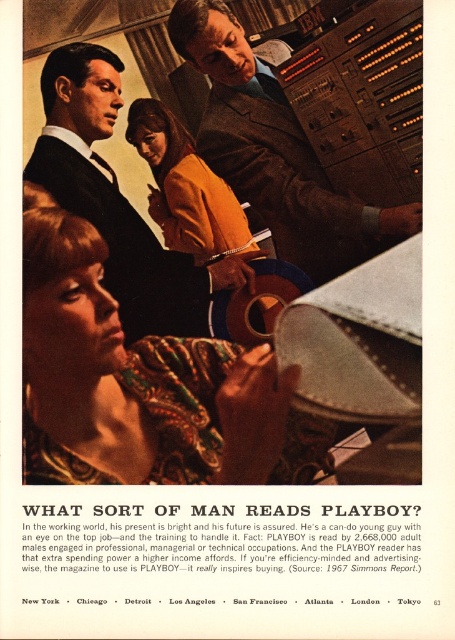
Is matte black suit at center above orange suede jacket at center?

Incorrect, matte black suit at center is not positioned above orange suede jacket at center.

Is point (55, 100) positioned before point (178, 236)?

That is True.

This screenshot has height=640, width=455. I want to click on matte black suit at center, so click(x=117, y=200).

Where is `matte black suit at center`? matte black suit at center is located at coordinates (117, 200).

Which is above, patterned fabric scarf at lower left or matte black suit at center?

matte black suit at center is higher up.

Is patterned fabric scarf at lower left wider than matte black suit at center?

In fact, patterned fabric scarf at lower left might be narrower than matte black suit at center.

Describe the element at coordinates (132, 380) in the screenshot. I see `patterned fabric scarf at lower left` at that location.

Find the location of a particular element. The width and height of the screenshot is (455, 640). patterned fabric scarf at lower left is located at coordinates (132, 380).

Between point (222, 435) and point (172, 202), which one is positioned behind?

Positioned behind is point (172, 202).

How distant is patterned fabric scarf at lower left from orange suede jacket at center?

They are 3.91 feet apart.

Is point (49, 440) positioned before point (141, 132)?

Yes, it is in front of point (141, 132).

This screenshot has height=640, width=455. I want to click on patterned fabric scarf at lower left, so click(x=132, y=380).